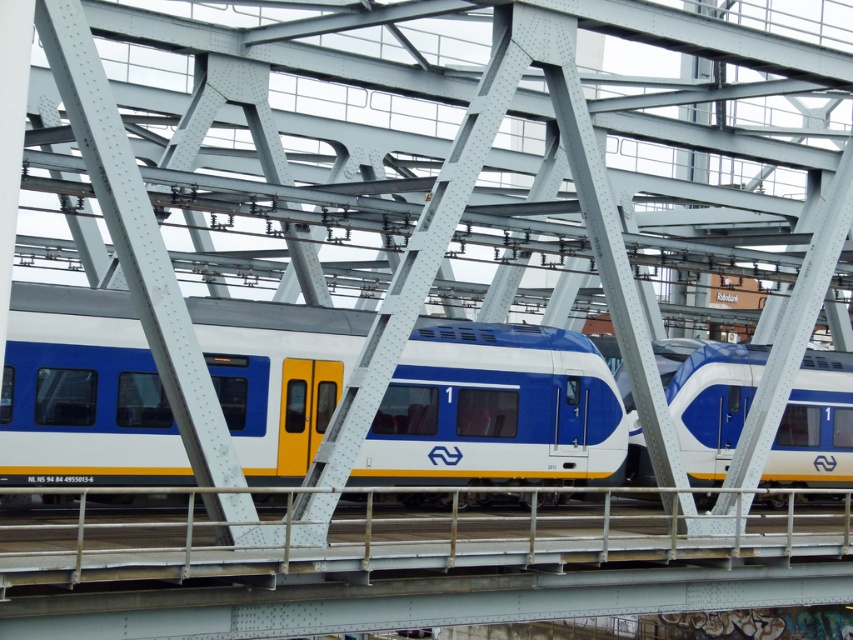
Question: Where is matte blue and white train at center located in relation to blue glossy train at center in the image?

Choices:
 (A) right
 (B) left

Answer: (B)

Question: Considering the relative positions of matte blue and white train at center and blue glossy train at center in the image provided, where is matte blue and white train at center located with respect to blue glossy train at center?

Choices:
 (A) above
 (B) below

Answer: (A)

Question: Is matte blue and white train at center to the right of blue glossy train at center from the viewer's perspective?

Choices:
 (A) no
 (B) yes

Answer: (A)

Question: Which object is closer to the camera taking this photo?

Choices:
 (A) matte blue and white train at center
 (B) blue glossy train at center

Answer: (A)

Question: Which point is farther to the camera?

Choices:
 (A) blue glossy train at center
 (B) matte blue and white train at center

Answer: (A)